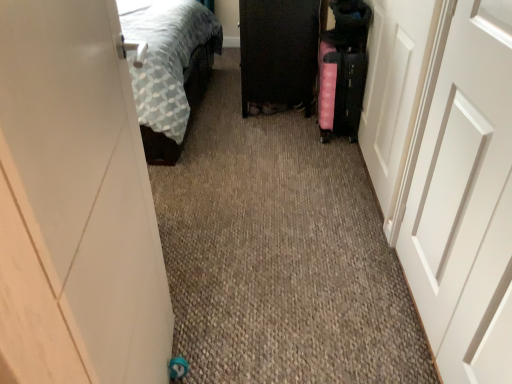
The image size is (512, 384). I want to click on vacant space in between white glossy door at right, which appears as the 1th door when viewed from the right, and pink fabric suitcase at right, so click(348, 178).